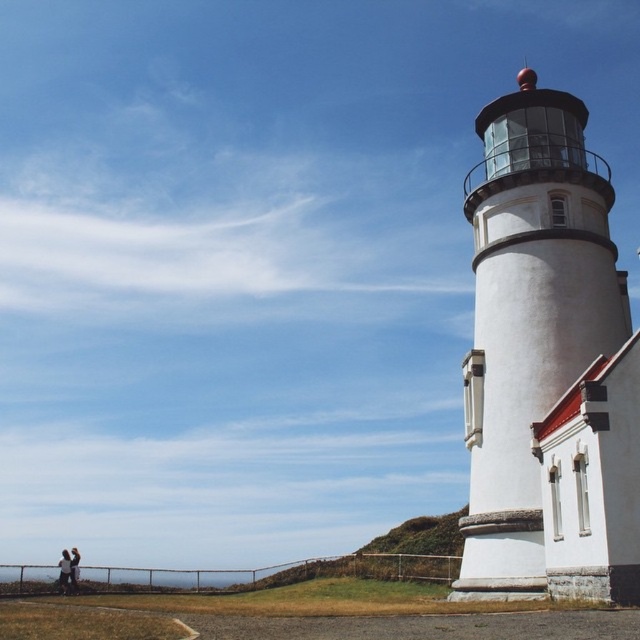
Question: Does white painted stone tower at right have a larger size compared to white cotton shirt at lower left?

Choices:
 (A) yes
 (B) no

Answer: (B)

Question: Is white painted stone tower at right wider than white cotton shirt at lower left?

Choices:
 (A) yes
 (B) no

Answer: (B)

Question: Which object appears farthest from the camera in this image?

Choices:
 (A) white painted stone tower at right
 (B) light brown leather jacket at lower left

Answer: (B)

Question: Can you confirm if white cotton shirt at lower left is bigger than light brown leather jacket at lower left?

Choices:
 (A) no
 (B) yes

Answer: (B)

Question: Among these objects, which one is farthest from the camera?

Choices:
 (A) light brown leather jacket at lower left
 (B) white painted stone tower at right
 (C) white cotton shirt at lower left

Answer: (A)

Question: Which point is farther to the camera?

Choices:
 (A) (67, 572)
 (B) (72, 577)

Answer: (B)